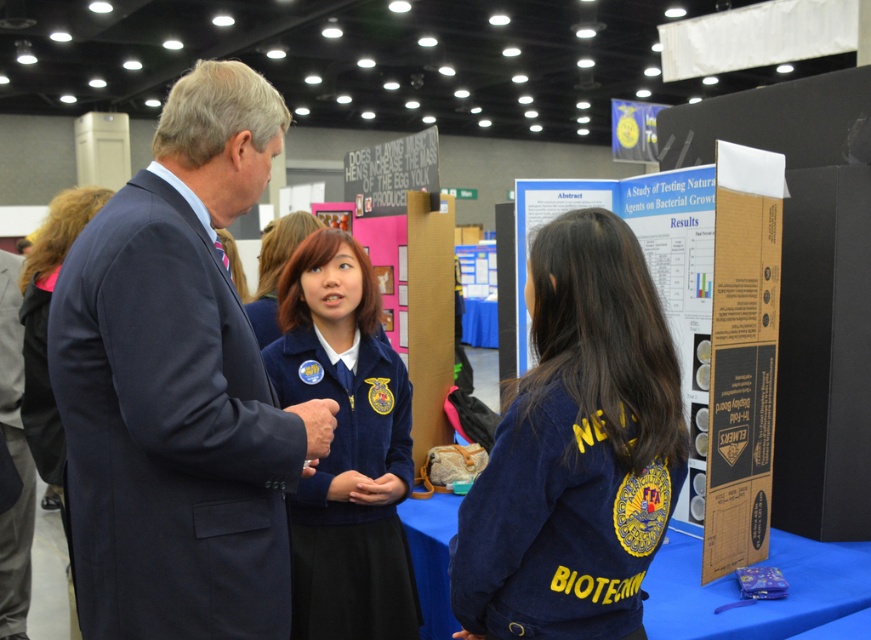
Is navy blue jacket at center shorter than blue velvety jacket at center?

Yes, navy blue jacket at center is shorter than blue velvety jacket at center.

Can you confirm if navy blue jacket at center is wider than blue velvety jacket at center?

Yes.

In order to click on navy blue jacket at center in this screenshot , I will do `click(576, 449)`.

At what (x,y) coordinates should I click in order to perform the action: click on navy blue jacket at center. Please return your answer as a coordinate pair (x, y). Looking at the image, I should click on (x=576, y=449).

Can you confirm if navy blue suit at left is smaller than matte blue uniform at center?

No, navy blue suit at left is not smaller than matte blue uniform at center.

Consider the image. Which is above, navy blue suit at left or matte blue uniform at center?

Positioned higher is matte blue uniform at center.

The width and height of the screenshot is (871, 640). What are the coordinates of `navy blue suit at left` in the screenshot? It's located at (179, 387).

Identify the location of navy blue suit at left. This screenshot has height=640, width=871. (179, 387).

Between navy blue suit at left and dark blue uniform at center, which one has less height?

navy blue suit at left is shorter.

Is point (217, 451) behind point (58, 202)?

No, (217, 451) is closer to viewer.

Between point (179, 572) and point (25, 384), which one is positioned behind?

The point (25, 384) is behind.

What are the coordinates of `navy blue suit at left` in the screenshot? It's located at (179, 387).